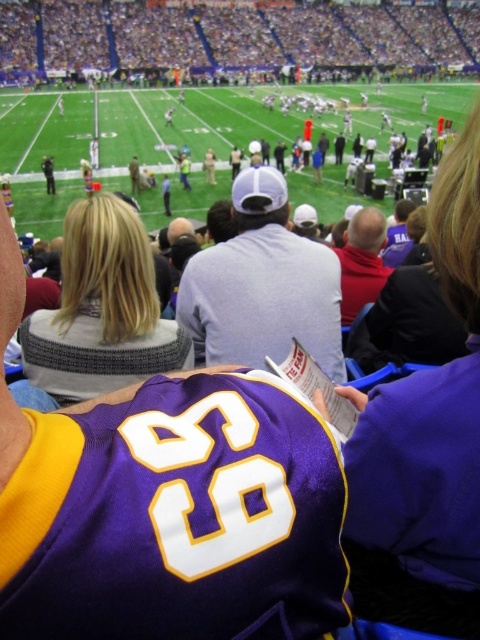
Question: Does gray cotton baseball cap at center lie in front of red matte shirt at center?

Choices:
 (A) yes
 (B) no

Answer: (A)

Question: Observing the image, what is the correct spatial positioning of gray cotton baseball cap at center in reference to red matte shirt at center?

Choices:
 (A) above
 (B) below

Answer: (B)

Question: Which point appears closest to the camera in this image?

Choices:
 (A) (228, 324)
 (B) (352, 298)

Answer: (A)

Question: Which object is closer to the camera taking this photo?

Choices:
 (A) gray cotton baseball cap at center
 (B) red matte shirt at center

Answer: (A)

Question: Is gray cotton baseball cap at center in front of red matte shirt at center?

Choices:
 (A) yes
 (B) no

Answer: (A)